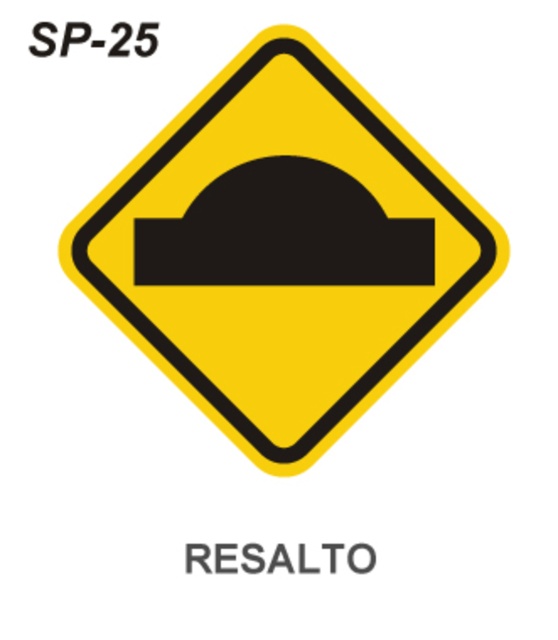
Question: Does yellow matte road sign at center appear under black rubber sign at center?

Choices:
 (A) no
 (B) yes

Answer: (B)

Question: Can you confirm if yellow matte road sign at center is positioned above black rubber sign at center?

Choices:
 (A) no
 (B) yes

Answer: (A)

Question: Which point appears closest to the camera in this image?

Choices:
 (A) (191, 211)
 (B) (234, 250)

Answer: (A)

Question: Can you confirm if yellow matte road sign at center is positioned above black rubber sign at center?

Choices:
 (A) yes
 (B) no

Answer: (B)

Question: Among these points, which one is farthest from the camera?

Choices:
 (A) (330, 179)
 (B) (406, 337)

Answer: (B)